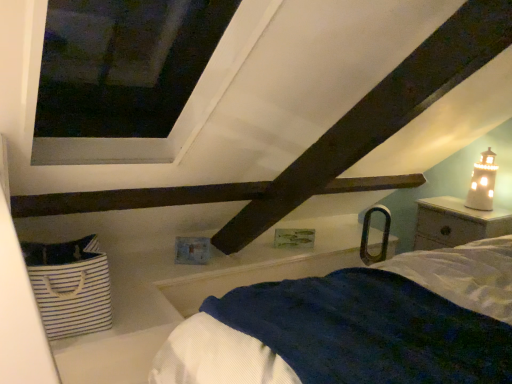
Identify the location of white ceramic lighthouse at upper right. (482, 183).

Find the location of a particular element. white ceramic lighthouse at upper right is located at coordinates (482, 183).

Considering the positions of point (96, 294) and point (489, 159), is point (96, 294) closer or farther from the camera than point (489, 159)?

Point (96, 294).

Is white striped fabric basket at lower left looking in the opposite direction of white ceramic lighthouse at upper right?

No.

Is white striped fabric basket at lower left outside of white ceramic lighthouse at upper right?

Yes, white striped fabric basket at lower left is not within white ceramic lighthouse at upper right.

From a real-world perspective, is white ceramic lighthouse at upper right positioned over white striped fabric basket at lower left based on gravity?

Yes, from a real-world perspective, white ceramic lighthouse at upper right is over white striped fabric basket at lower left

The width and height of the screenshot is (512, 384). Find the location of `table lamp behind the white striped fabric basket at lower left`. table lamp behind the white striped fabric basket at lower left is located at coordinates (482, 183).

How distant is white ceramic lighthouse at upper right from white striped fabric basket at lower left?

They are 2.17 meters apart.

Would you consider white ceramic lighthouse at upper right to be distant from white striped fabric basket at lower left?

Yes, white ceramic lighthouse at upper right and white striped fabric basket at lower left are located far from each other.

From the image's perspective, which one is positioned lower, white striped fabric basket at lower left or white wood nightstand at right?

white striped fabric basket at lower left.

Could you tell me if white striped fabric basket at lower left is turned towards white wood nightstand at right?

No.

Is white striped fabric basket at lower left inside or outside of white wood nightstand at right?

white striped fabric basket at lower left cannot be found inside white wood nightstand at right.

Between white striped fabric basket at lower left and white wood nightstand at right, which one has larger width?

With larger width is white wood nightstand at right.

Can you confirm if white wood nightstand at right is positioned to the left of white ceramic lighthouse at upper right?

Indeed, white wood nightstand at right is positioned on the left side of white ceramic lighthouse at upper right.

From the image's perspective, is white wood nightstand at right positioned above or below white ceramic lighthouse at upper right?

Based on their image positions, white wood nightstand at right is located beneath white ceramic lighthouse at upper right.

Which object is thinner, white wood nightstand at right or white ceramic lighthouse at upper right?

Thinner between the two is white ceramic lighthouse at upper right.

Is white wood nightstand at right completely or partially outside of white ceramic lighthouse at upper right?

Yes, white wood nightstand at right is located beyond the bounds of white ceramic lighthouse at upper right.

Looking at this image, is white ceramic lighthouse at upper right facing towards white wood nightstand at right?

No, white ceramic lighthouse at upper right is not turned towards white wood nightstand at right.

Which of these two, white ceramic lighthouse at upper right or white wood nightstand at right, stands shorter?

white ceramic lighthouse at upper right.

Would you say white ceramic lighthouse at upper right is a long distance from white wood nightstand at right?

They are positioned close to each other.

Considering the sizes of objects white ceramic lighthouse at upper right and white wood nightstand at right in the image provided, who is thinner, white ceramic lighthouse at upper right or white wood nightstand at right?

white ceramic lighthouse at upper right is thinner.

Is white wood nightstand at right placed right next to white striped fabric basket at lower left?

No, white wood nightstand at right is not making contact with white striped fabric basket at lower left.

Is white striped fabric basket at lower left located within white wood nightstand at right?

No, white striped fabric basket at lower left is not a part of white wood nightstand at right.

Is white wood nightstand at right looking in the opposite direction of white striped fabric basket at lower left?

That's not correct — white wood nightstand at right is not looking away from white striped fabric basket at lower left.

Between white wood nightstand at right and white striped fabric basket at lower left, which one has larger width?

Wider between the two is white wood nightstand at right.

Locate an element on the screen. table lamp located above the white striped fabric basket at lower left (from a real-world perspective) is located at coordinates (482, 183).

I want to click on table lamp lying above the white striped fabric basket at lower left (from the image's perspective), so click(482, 183).

Looking at the image, which one is located further to white striped fabric basket at lower left, white ceramic lighthouse at upper right or white wood nightstand at right?

Based on the image, white ceramic lighthouse at upper right appears to be further to white striped fabric basket at lower left.

Estimate the real-world distances between objects in this image. Which object is closer to white striped fabric basket at lower left, white wood nightstand at right or white ceramic lighthouse at upper right?

Based on the image, white wood nightstand at right appears to be nearer to white striped fabric basket at lower left.

When comparing their distances from white ceramic lighthouse at upper right, does white wood nightstand at right or white striped fabric basket at lower left seem closer?

white wood nightstand at right.

From the image, which object appears to be farther from white ceramic lighthouse at upper right, white striped fabric basket at lower left or white wood nightstand at right?

The object further to white ceramic lighthouse at upper right is white striped fabric basket at lower left.

Which object lies nearer to the anchor point white wood nightstand at right, white ceramic lighthouse at upper right or white striped fabric basket at lower left?

Based on the image, white ceramic lighthouse at upper right appears to be nearer to white wood nightstand at right.

Considering their positions, is white striped fabric basket at lower left positioned closer to white wood nightstand at right than white ceramic lighthouse at upper right?

white ceramic lighthouse at upper right.

I want to click on nightstand located between white striped fabric basket at lower left and white ceramic lighthouse at upper right in the left-right direction, so pos(456,223).